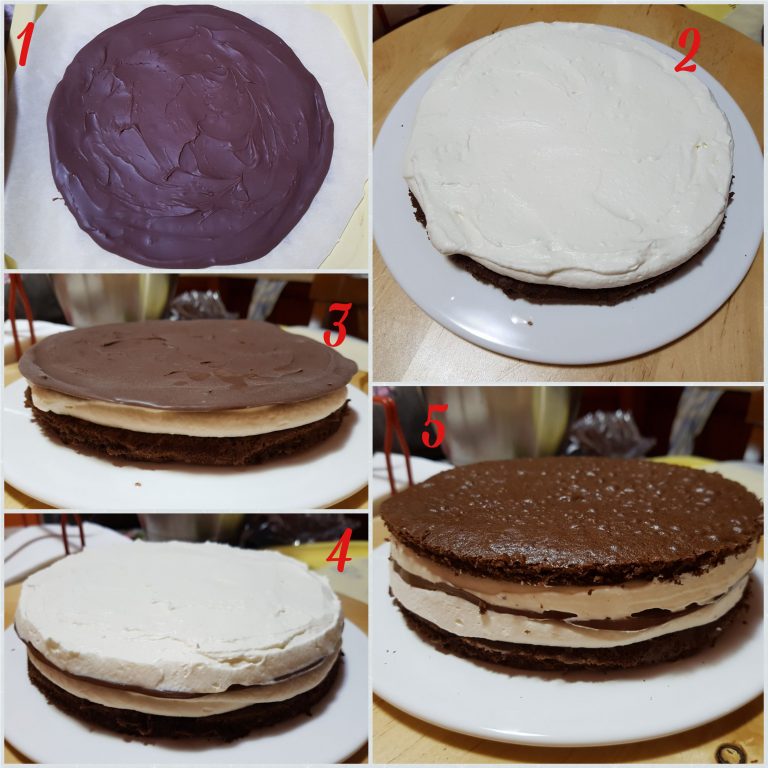
You are a GUI agent. You are given a task and a screenshot of the screen. Output one action in this format:
    pyautogui.click(x=<x>, y=<y>)
    Task: Click on the baking sheet
    The width and height of the screenshot is (768, 768).
    Given the screenshot: What is the action you would take?
    pyautogui.click(x=53, y=234)